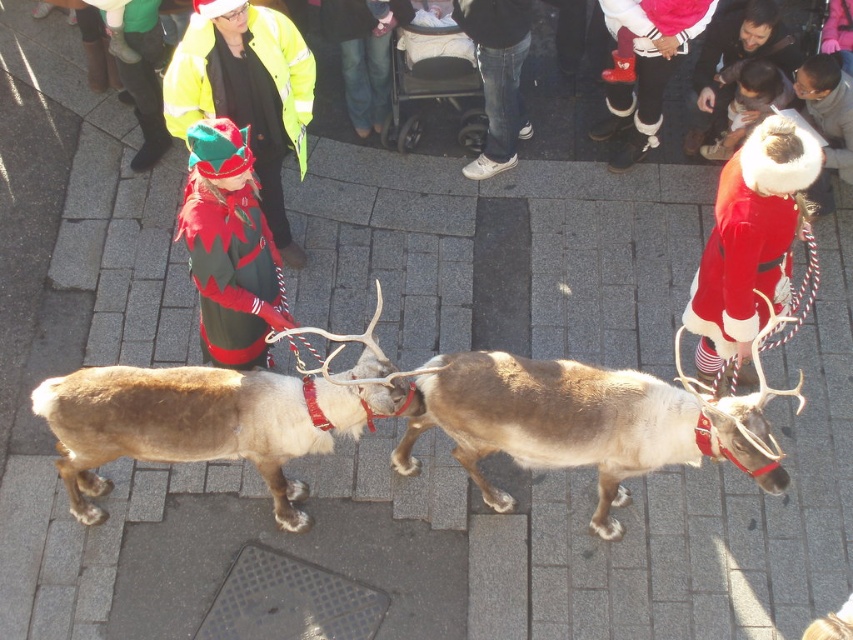
Question: Based on their relative distances, which object is farther from the velvet green coat at center?

Choices:
 (A) velvet red coat at upper right
 (B) brown fur reindeer at center
 (C) brown fuzzy reindeer at center

Answer: (A)

Question: Considering the real-world distances, which object is farthest from the velvet red coat at upper right?

Choices:
 (A) brown fur reindeer at center
 (B) brown fuzzy reindeer at center
 (C) velvet green coat at center

Answer: (C)

Question: Does velvet red coat at upper right appear over shiny yellow jacket at upper left?

Choices:
 (A) no
 (B) yes

Answer: (A)

Question: Is shiny yellow jacket at upper left wider than velvet green coat at center?

Choices:
 (A) yes
 (B) no

Answer: (A)

Question: Is velvet red coat at upper right thinner than shiny yellow jacket at upper left?

Choices:
 (A) yes
 (B) no

Answer: (A)

Question: Among these points, which one is farthest from the camera?

Choices:
 (A) 343,426
 (B) 207,12
 (C) 787,228

Answer: (B)